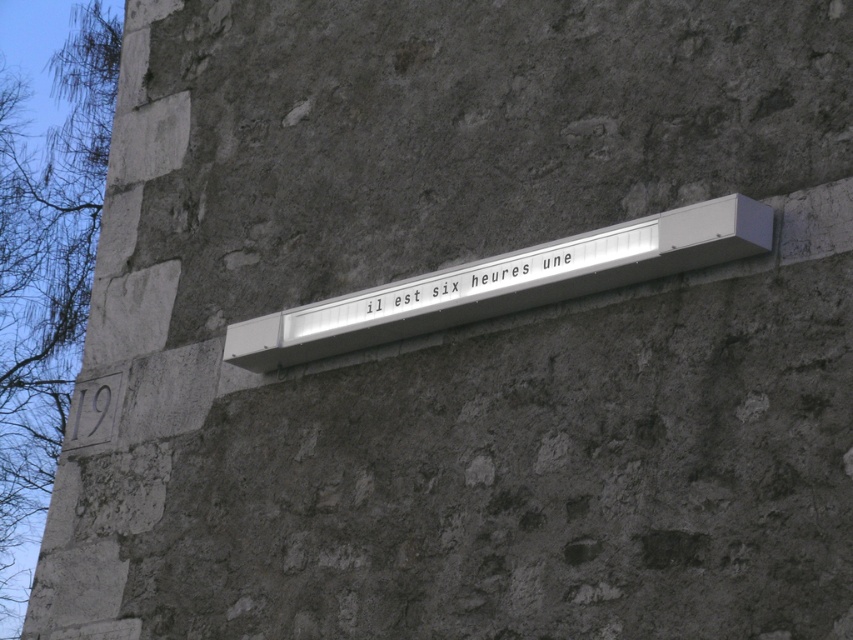
Which is more to the left, white plastic sign at center or white metallic sign at center?

white metallic sign at center is more to the left.

Which is in front, point (390, 337) or point (573, 252)?

Positioned in front is point (573, 252).

This screenshot has width=853, height=640. I want to click on white plastic sign at center, so click(506, 284).